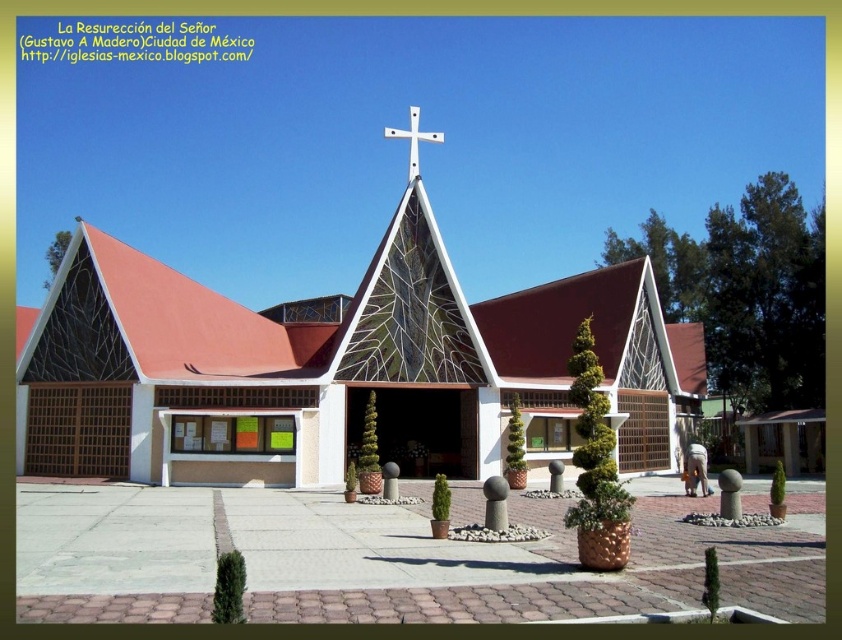
From the picture: Who is more forward, (488,400) or (390,136)?

Point (488,400) is in front.

Does point (418, 333) come behind point (409, 147)?

No, (418, 333) is in front of (409, 147).

Does point (315, 380) lie in front of point (429, 138)?

Yes, it is.

Find the location of `white glass church at center`. white glass church at center is located at coordinates (334, 369).